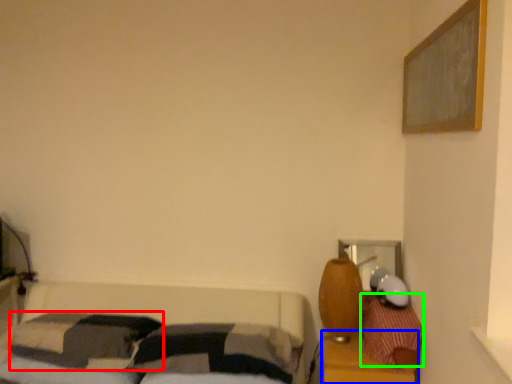
Question: Estimate the real-world distances between objects in this image. Which object is farther from pillow (highlighted by a red box), dresser (highlighted by a blue box) or pillow (highlighted by a green box)?

Choices:
 (A) dresser
 (B) pillow

Answer: (B)